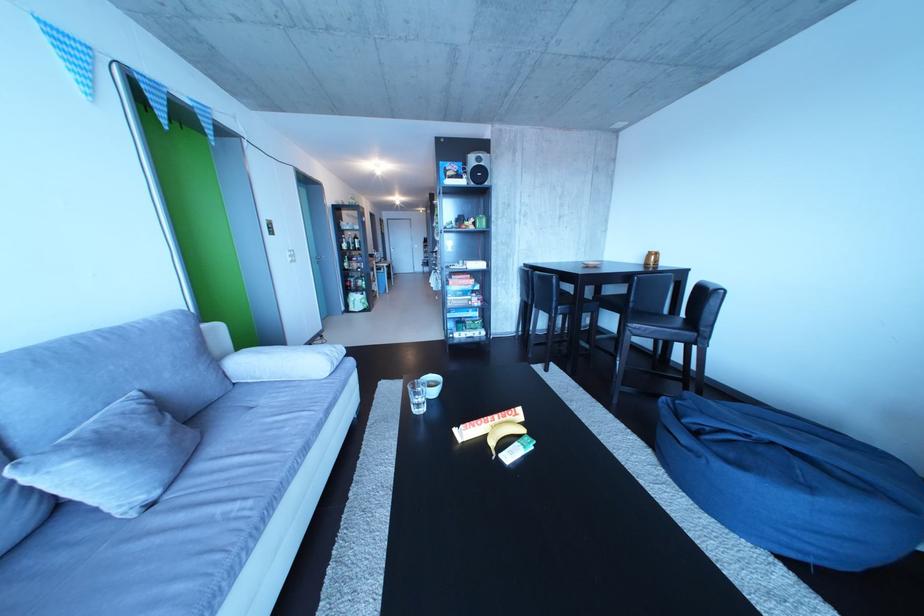
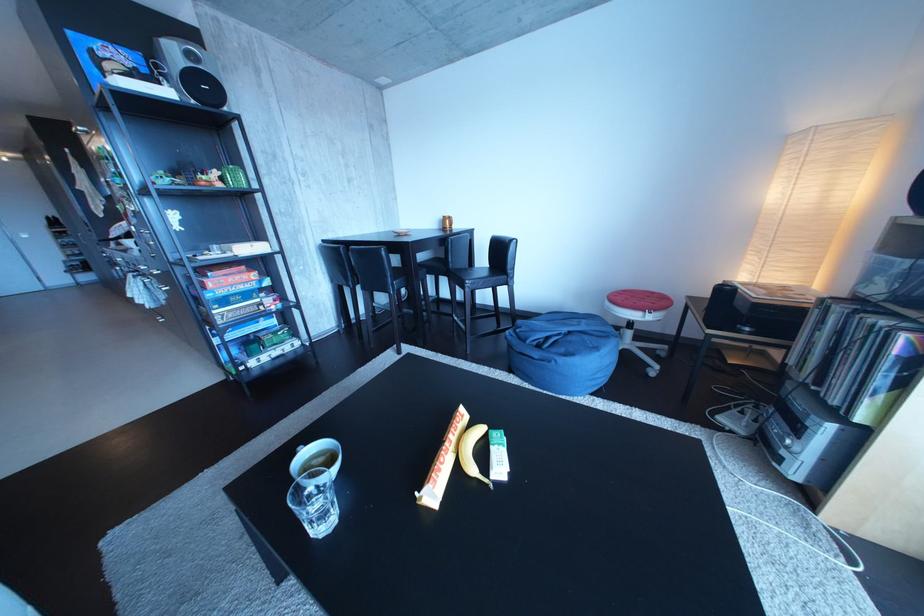
In the second image, find the point that corresponds to (424,402) in the first image.

(317, 522)